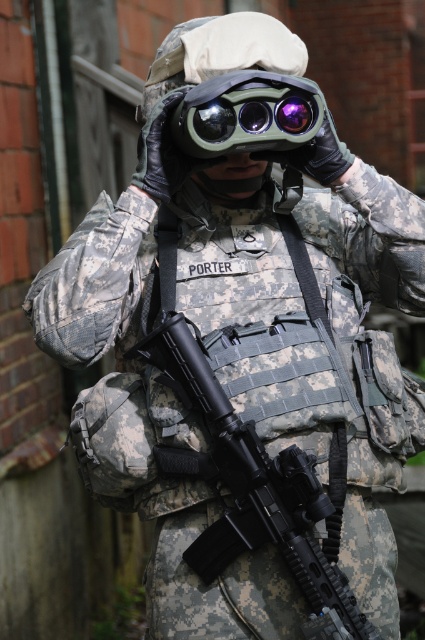
Question: Does black matte rifle at center appear on the left side of green matte binoculars at center?

Choices:
 (A) yes
 (B) no

Answer: (B)

Question: Does black matte rifle at center appear over green matte binoculars at center?

Choices:
 (A) no
 (B) yes

Answer: (A)

Question: Among these objects, which one is nearest to the camera?

Choices:
 (A) black matte rifle at center
 (B) green matte binoculars at center

Answer: (A)

Question: Is black matte rifle at center further to camera compared to green matte binoculars at center?

Choices:
 (A) yes
 (B) no

Answer: (B)